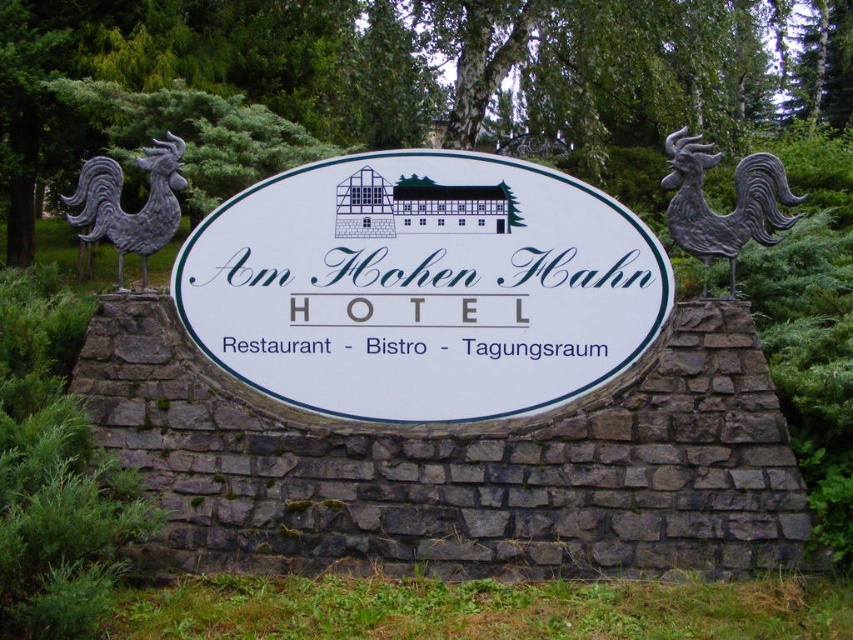
Is blue plastic text at center above blue plastic sign at center?

Indeed, blue plastic text at center is positioned over blue plastic sign at center.

Who is more forward, (x=300, y=349) or (x=366, y=346)?

Positioned in front is point (x=366, y=346).

This screenshot has width=853, height=640. What do you see at coordinates (274, 346) in the screenshot?
I see `blue plastic text at center` at bounding box center [274, 346].

This screenshot has width=853, height=640. Find the location of `blue plastic text at center`. blue plastic text at center is located at coordinates (274, 346).

Does point (216, 298) come closer to viewer compared to point (367, 348)?

No, (216, 298) is behind (367, 348).

Is white paper sign at center behind blue plastic sign at center?

No, white paper sign at center is in front of blue plastic sign at center.

At what (x,y) coordinates should I click in order to perform the action: click on white paper sign at center. Please return your answer as a coordinate pair (x, y). This screenshot has width=853, height=640. Looking at the image, I should click on (424, 284).

This screenshot has height=640, width=853. Identify the location of white paper sign at center. (424, 284).

Find the location of a particular element. This screenshot has height=640, width=853. white paper sign at center is located at coordinates (424, 284).

Find the location of a particular element. This screenshot has width=853, height=640. white paper sign at center is located at coordinates (424, 284).